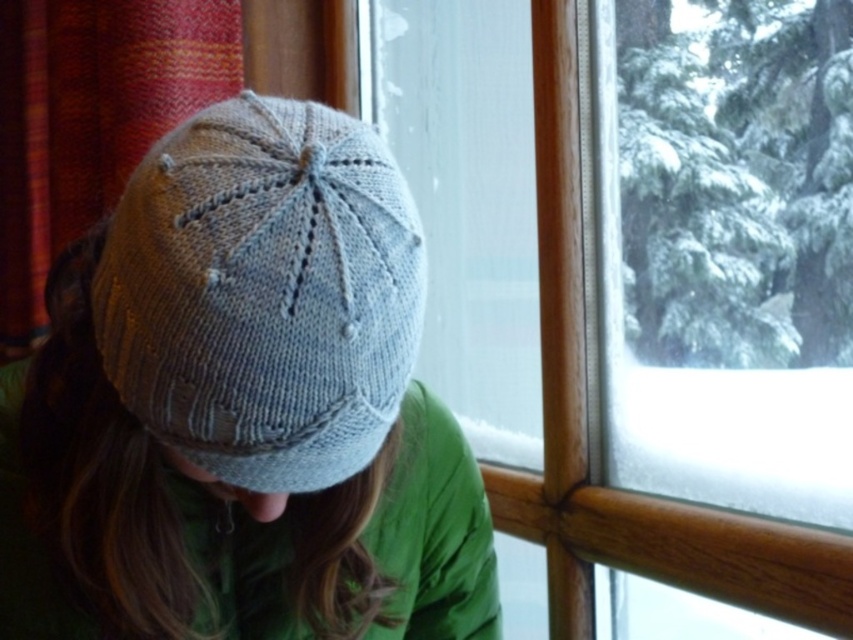
In the scene shown: Is the position of knitted woolen hat at center more distant than that of knitted gray hat at center?

Yes, knitted woolen hat at center is further from the viewer.

Describe the element at coordinates (242, 406) in the screenshot. The height and width of the screenshot is (640, 853). I see `knitted woolen hat at center` at that location.

Image resolution: width=853 pixels, height=640 pixels. What are the coordinates of `knitted woolen hat at center` in the screenshot? It's located at (242, 406).

Can you confirm if transparent glass window at center is smaller than knitted gray hat at center?

Actually, transparent glass window at center might be larger than knitted gray hat at center.

Where is `transparent glass window at center`? Image resolution: width=853 pixels, height=640 pixels. transparent glass window at center is located at coordinates (637, 269).

Can you confirm if transparent glass window at center is positioned below knitted woolen hat at center?

No, transparent glass window at center is not below knitted woolen hat at center.

Locate an element on the screen. The width and height of the screenshot is (853, 640). transparent glass window at center is located at coordinates (637, 269).